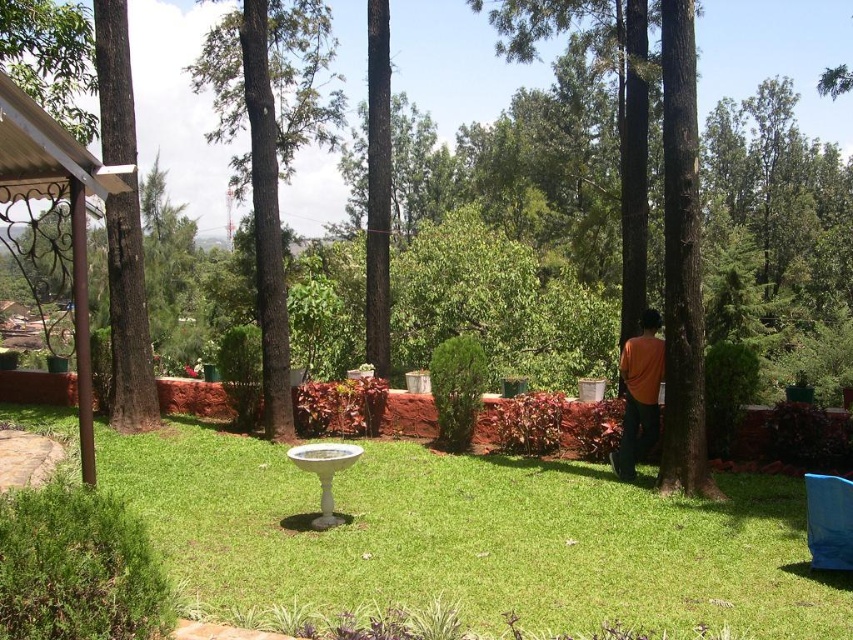
Question: Observing the image, what is the correct spatial positioning of brown wrought iron gazebo at left in reference to orange cotton shirt at center-right?

Choices:
 (A) left
 (B) right

Answer: (A)

Question: Which object is the closest to the orange cotton shirt at center-right?

Choices:
 (A) brown rough tree at left
 (B) brown wrought iron gazebo at left
 (C) green grass at center
 (D) dark green bark tree at center

Answer: (C)

Question: Among these objects, which one is nearest to the camera?

Choices:
 (A) orange cotton shirt at center-right
 (B) green grass at center
 (C) brown rough tree at left
 (D) dark green bark tree at center

Answer: (B)

Question: Which of these objects is positioned closest to the orange cotton shirt at center-right?

Choices:
 (A) green grass at center
 (B) brown wrought iron gazebo at left

Answer: (A)

Question: Is green grass at center thinner than orange cotton shirt at center-right?

Choices:
 (A) no
 (B) yes

Answer: (A)

Question: Where is brown rough tree at left located in relation to brown wrought iron gazebo at left in the image?

Choices:
 (A) above
 (B) below

Answer: (B)